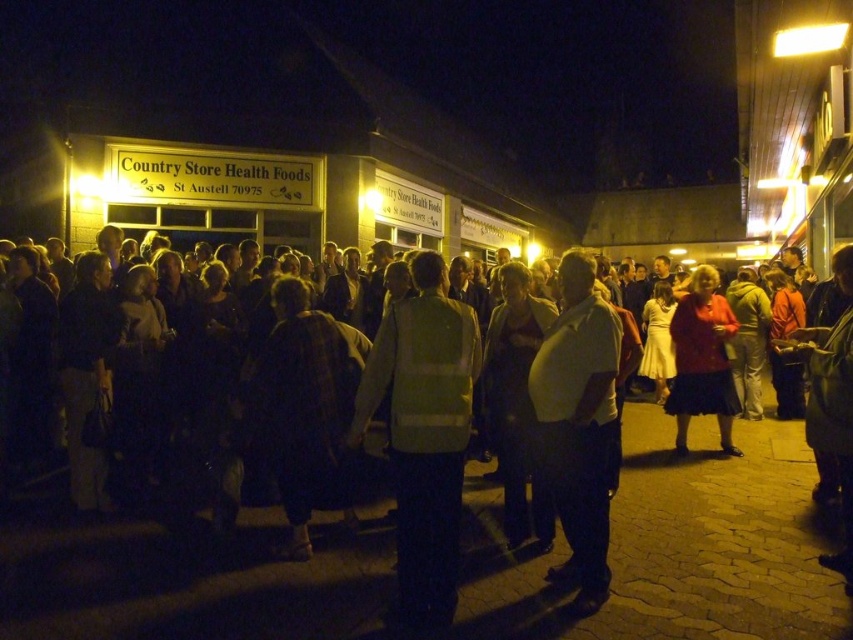
You are a photographer standing in front of the Country Store Health Foods at night. You want to take a photo that captures both the dark clothing crowd at center and the reflective yellow vest at center. Which object should you focus on first to ensure both are in focus?

You should focus on the dark clothing crowd at center first because it is closer to you than the reflective yellow vest at center. By focusing on the closer object, the farther object will also be in focus due to the depth of field.

You are a pedestrian trying to cross the street near the Country Store Health Foods. You notice the dark clothing crowd at center and the reflective yellow vest at center. Which object is closer to the ground?

The dark clothing crowd at center is located below reflective yellow vest at center, so the dark clothing crowd at center is closer to the ground.